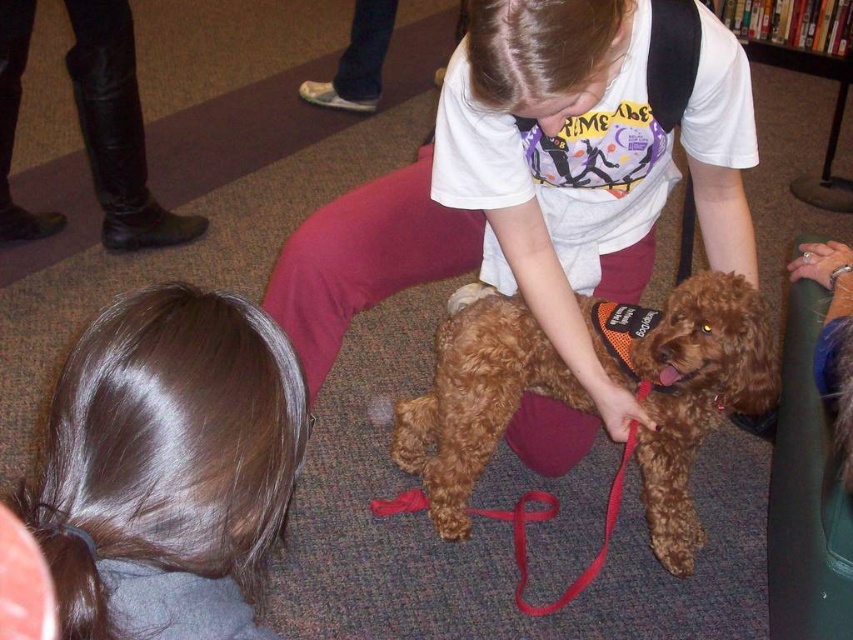
Question: Does brown shiny hair at lower left appear over brown fuzzy dog at center?

Choices:
 (A) no
 (B) yes

Answer: (B)

Question: Can you confirm if brown shiny hair at lower left is bigger than brown fuzzy dog at center?

Choices:
 (A) no
 (B) yes

Answer: (A)

Question: Which point appears closest to the camera in this image?

Choices:
 (A) (105, 588)
 (B) (459, 323)

Answer: (A)

Question: Which point is closer to the camera?

Choices:
 (A) (425, 472)
 (B) (212, 605)

Answer: (B)

Question: Is brown shiny hair at lower left smaller than brown fuzzy dog at center?

Choices:
 (A) yes
 (B) no

Answer: (A)